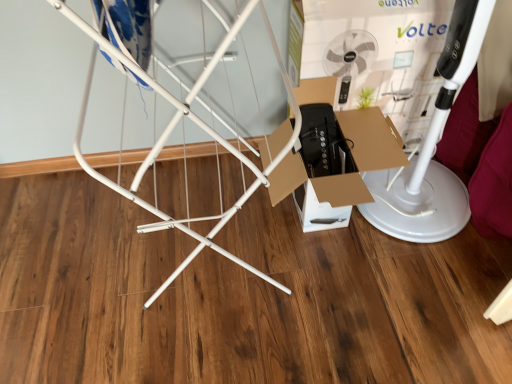
The height and width of the screenshot is (384, 512). Describe the element at coordinates (335, 160) in the screenshot. I see `cardboard box at center` at that location.

Where is `cardboard box at center`? The width and height of the screenshot is (512, 384). cardboard box at center is located at coordinates (335, 160).

At what (x,y) coordinates should I click in order to perform the action: click on cardboard box at center. Please return your answer as a coordinate pair (x, y). Looking at the image, I should click on (335, 160).